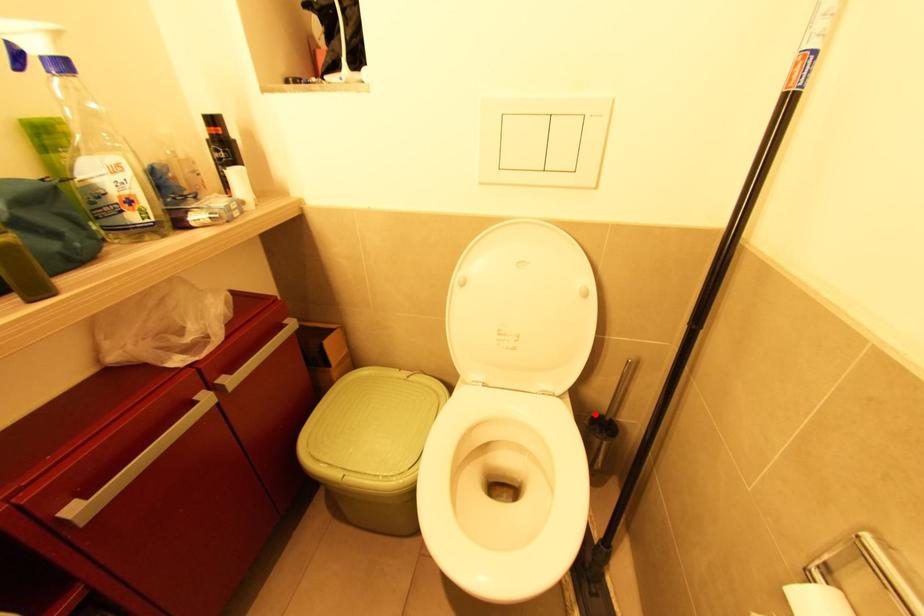
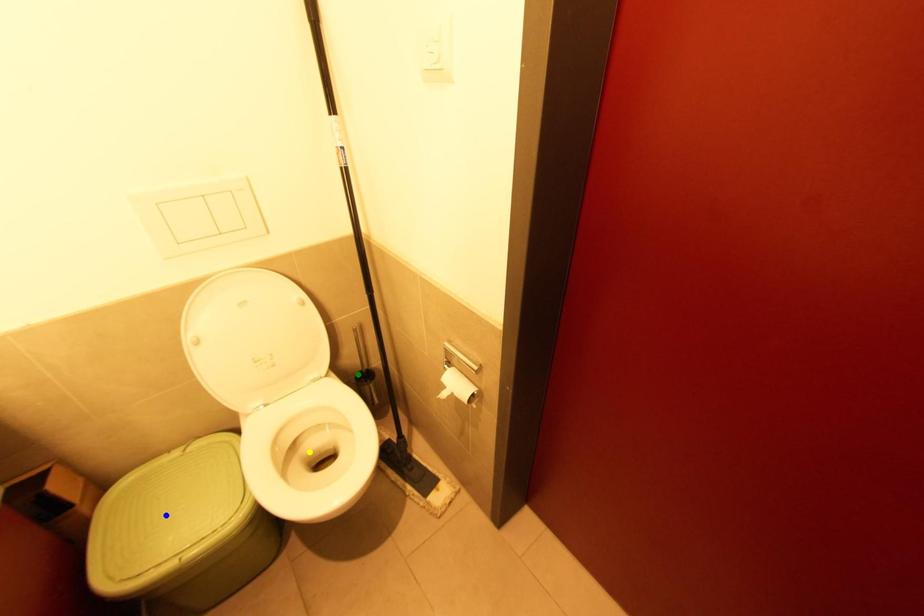
Question: I am providing you with two images of the same scene from different viewpoints. A red point is marked on the first image. You are given multiple points on the second image. Can you choose the point in image 2 that corresponds to the point in image 1?

Choices:
 (A) green point
 (B) blue point
 (C) yellow point

Answer: (A)